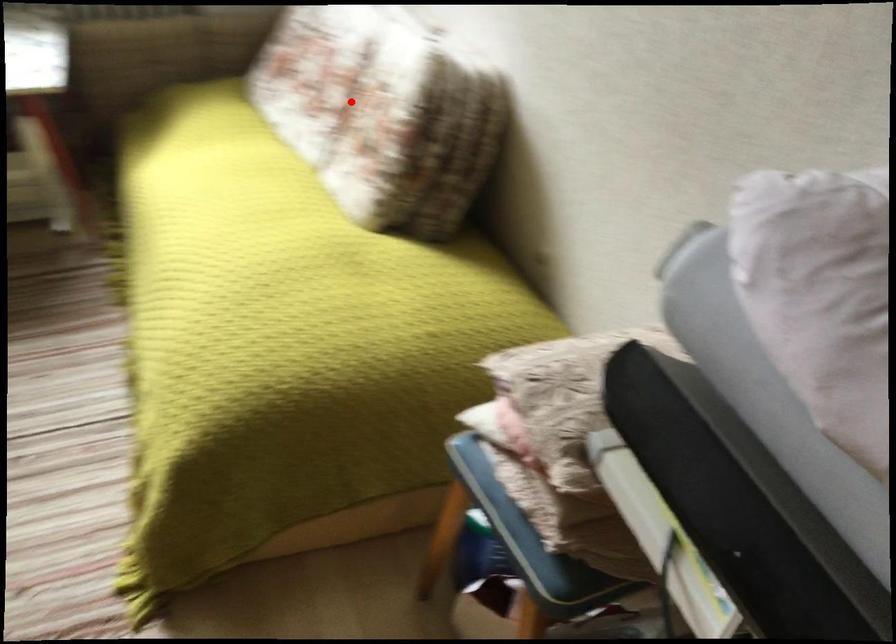
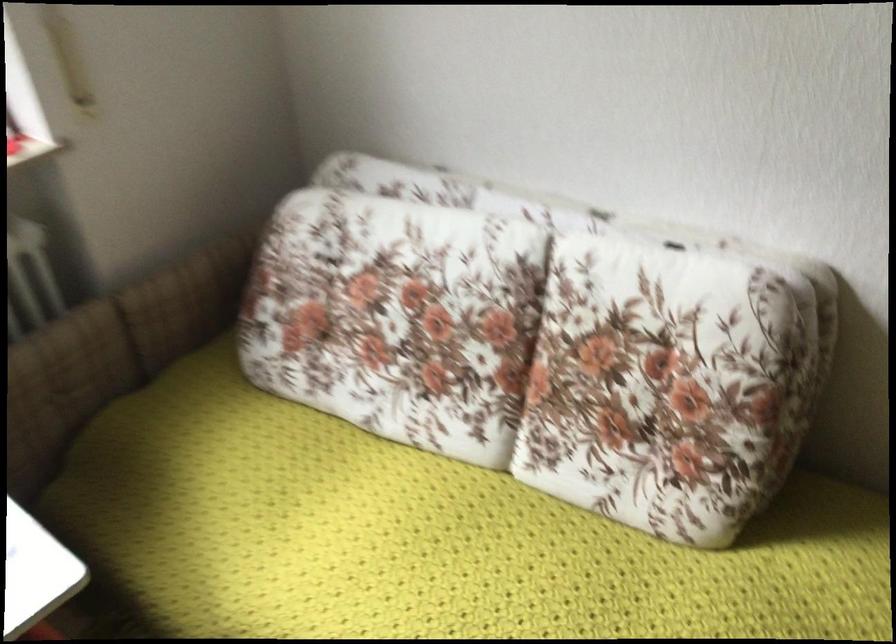
Question: A red point is marked in image1. In image2, is the corresponding 3D point closer to the camera or farther? Reply with the corresponding letter.

Choices:
 (A) The corresponding 3D point is closer.
 (B) The corresponding 3D point is farther.

Answer: (A)